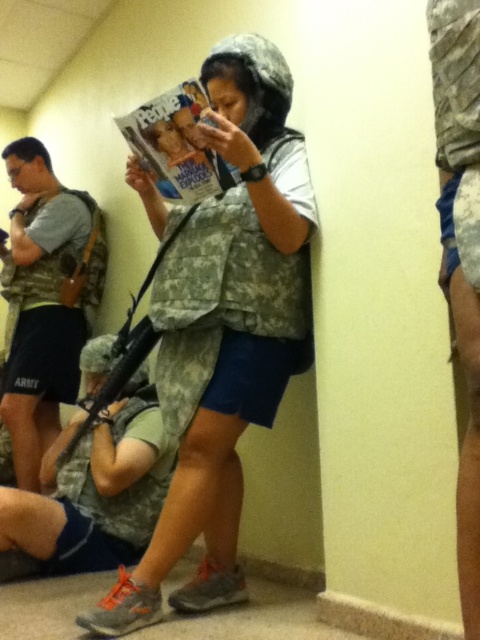
Can you confirm if camouflage fabric backpack at left is taller than camouflage fabric rifle at center?

Indeed, camouflage fabric backpack at left has a greater height compared to camouflage fabric rifle at center.

Who is lower down, camouflage fabric backpack at left or camouflage fabric rifle at center?

camouflage fabric rifle at center

Which is behind, point (54, 214) or point (87, 476)?

Point (54, 214)

Image resolution: width=480 pixels, height=640 pixels. In order to click on camouflage fabric backpack at left in this screenshot , I will do `click(46, 300)`.

Between camouflage vest at center and matte paper magazine at center, which one has less height?

With less height is matte paper magazine at center.

How much distance is there between camouflage vest at center and matte paper magazine at center?

camouflage vest at center is 12.56 inches from matte paper magazine at center.

Between point (252, 241) and point (189, 164), which one is positioned behind?

Positioned behind is point (252, 241).

I want to click on camouflage vest at center, so click(225, 330).

Does camouflage fabric backpack at left have a lesser width compared to matte paper magazine at center?

Answer: No.

This screenshot has height=640, width=480. What do you see at coordinates (46, 300) in the screenshot? I see `camouflage fabric backpack at left` at bounding box center [46, 300].

Describe the element at coordinates (46, 300) in the screenshot. I see `camouflage fabric backpack at left` at that location.

You are a GUI agent. You are given a task and a screenshot of the screen. Output one action in this format:
    pyautogui.click(x=<x>, y=<y>)
    Task: Click on the camouflage fabric backpack at left
    This screenshot has height=640, width=480.
    Given the screenshot: What is the action you would take?
    pyautogui.click(x=46, y=300)